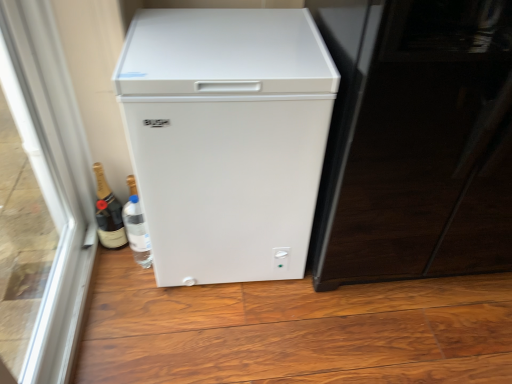
Question: Is matte gold champagne bottle at lower left positioned before transparent glass door at left?

Choices:
 (A) no
 (B) yes

Answer: (A)

Question: Does matte gold champagne bottle at lower left appear on the right side of transparent glass door at left?

Choices:
 (A) yes
 (B) no

Answer: (A)

Question: Could you tell me if matte gold champagne bottle at lower left is turned towards transparent glass door at left?

Choices:
 (A) no
 (B) yes

Answer: (A)

Question: Is matte gold champagne bottle at lower left far from transparent glass door at left?

Choices:
 (A) yes
 (B) no

Answer: (B)

Question: From a real-world perspective, is matte gold champagne bottle at lower left physically above transparent glass door at left?

Choices:
 (A) yes
 (B) no

Answer: (B)

Question: Is matte gold champagne bottle at lower left turned away from transparent glass door at left?

Choices:
 (A) yes
 (B) no

Answer: (B)

Question: Is glossy black screen door at right at the right side of white matte refrigerator at center?

Choices:
 (A) no
 (B) yes

Answer: (B)

Question: Is glossy black screen door at right not within white matte refrigerator at center?

Choices:
 (A) no
 (B) yes

Answer: (B)

Question: Can you confirm if glossy black screen door at right is wider than white matte refrigerator at center?

Choices:
 (A) yes
 (B) no

Answer: (A)

Question: From the image's perspective, is glossy black screen door at right over white matte refrigerator at center?

Choices:
 (A) yes
 (B) no

Answer: (A)

Question: Could you tell me if glossy black screen door at right is turned towards white matte refrigerator at center?

Choices:
 (A) no
 (B) yes

Answer: (A)

Question: Can you confirm if glossy black screen door at right is smaller than white matte refrigerator at center?

Choices:
 (A) yes
 (B) no

Answer: (B)

Question: Considering the relative sizes of transparent glass door at left and white matte refrigerator at center in the image provided, is transparent glass door at left shorter than white matte refrigerator at center?

Choices:
 (A) yes
 (B) no

Answer: (B)